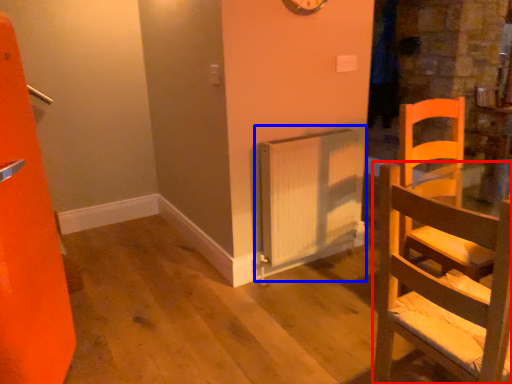
Question: Which of the following is the farthest to the observer, chair (highlighted by a red box) or radiator (highlighted by a blue box)?

Choices:
 (A) chair
 (B) radiator

Answer: (B)